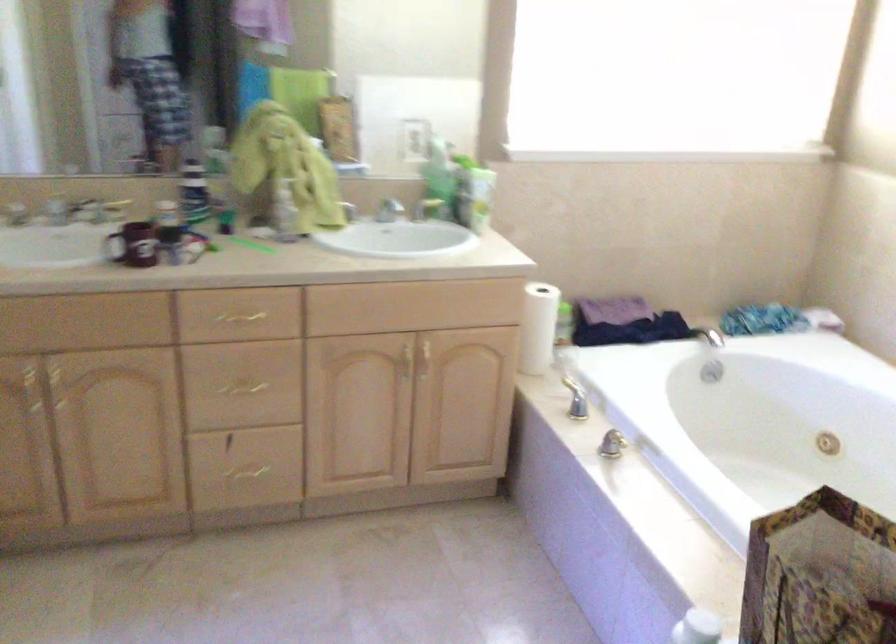
Find where to turn the bathtub faucet handle. Please return your answer as a coordinate pair (x, y).

(625, 442)